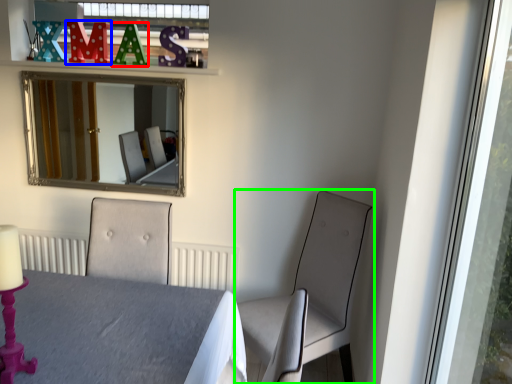
Question: Which object is positioned closest to alphabet (highlighted by a red box)? Select from alphabet (highlighted by a blue box) and chair (highlighted by a green box).

Choices:
 (A) alphabet
 (B) chair

Answer: (A)